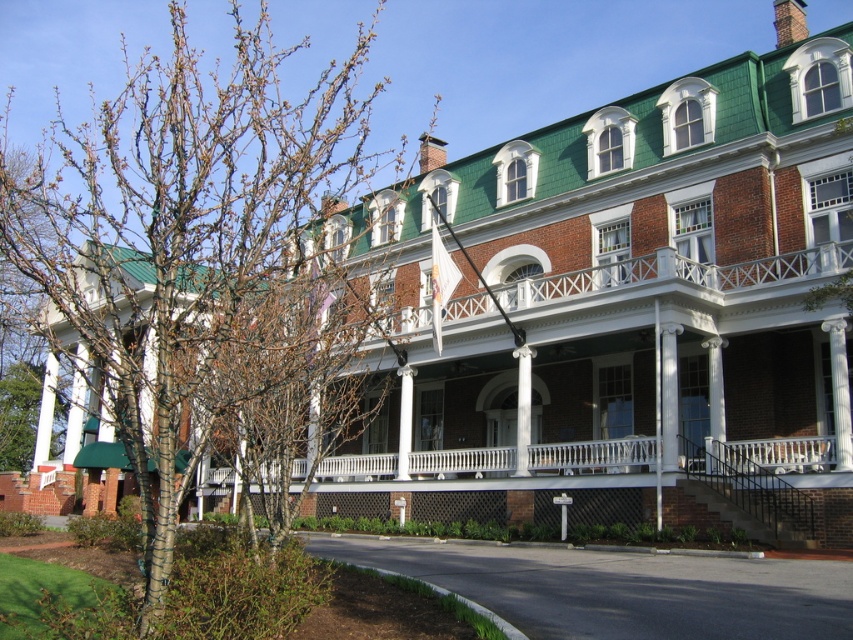
Question: Is bare branches at left above white painted wood porch at center?

Choices:
 (A) no
 (B) yes

Answer: (B)

Question: Does white painted wood porch at center appear on the left side of white smooth column at center?

Choices:
 (A) no
 (B) yes

Answer: (B)

Question: Does bare branches at left have a lesser width compared to white painted wood porch at center?

Choices:
 (A) no
 (B) yes

Answer: (A)

Question: Considering the real-world distances, which object is closest to the white smooth column at center?

Choices:
 (A) white painted wood porch at center
 (B) bare branches at left

Answer: (A)

Question: Which point is closer to the camera taking this photo?

Choices:
 (A) (527, 396)
 (B) (496, 460)
 (C) (221, 317)

Answer: (C)

Question: Which point is farther to the camera?

Choices:
 (A) (520, 452)
 (B) (373, 477)
 (C) (131, 385)
 (D) (9, 444)

Answer: (D)